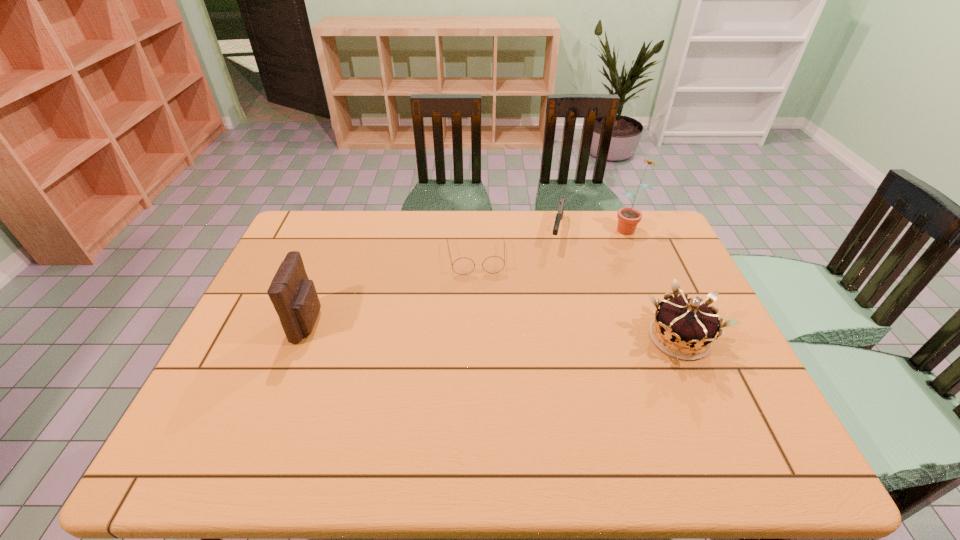
Locate an element on the screen. The height and width of the screenshot is (540, 960). gun at the far edge is located at coordinates point(559,216).

Locate an element on the screen. sunflower that is at the far edge is located at coordinates (628, 218).

The height and width of the screenshot is (540, 960). What are the coordinates of `object that is at the left edge` in the screenshot? It's located at (294, 297).

Where is `crown present at the right edge`? The height and width of the screenshot is (540, 960). crown present at the right edge is located at coordinates tap(684, 328).

Where is `sunflower situated at the right edge`? This screenshot has width=960, height=540. sunflower situated at the right edge is located at coordinates (628, 218).

Locate an element on the screen. This screenshot has width=960, height=540. object located in the far right corner section of the desktop is located at coordinates (628, 218).

Where is `vacant area at the far edge`? vacant area at the far edge is located at coordinates (478, 215).

Locate an element on the screen. vacant area at the near edge is located at coordinates coord(444,415).

This screenshot has height=540, width=960. Find the location of `vacant space at the left edge`. vacant space at the left edge is located at coordinates (280, 350).

Identify the location of free space at the far left corner of the desktop. The height and width of the screenshot is (540, 960). (327, 215).